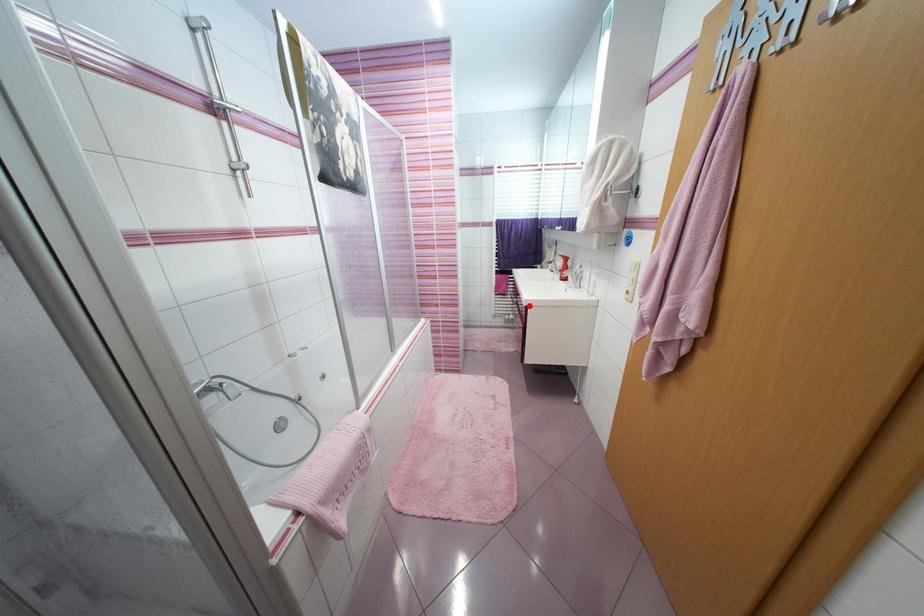
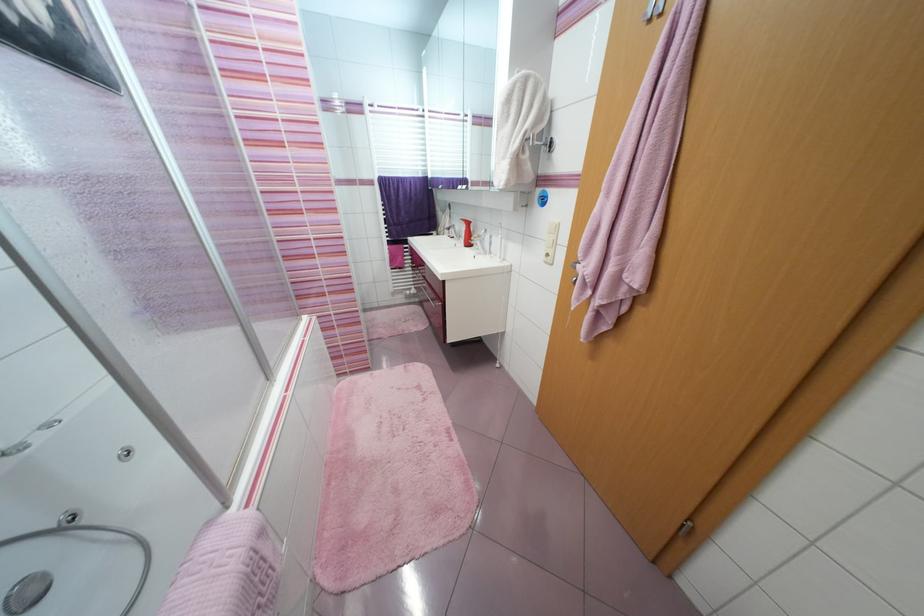
Where in the second image is the point corresponding to the highlighted location from the first image?

(445, 281)